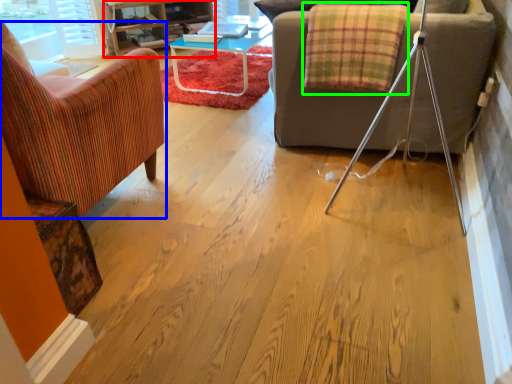
Question: Based on their relative distances, which object is farther from entertainment center (highlighted by a red box)? Choose from chair (highlighted by a blue box) and blanket (highlighted by a green box).

Choices:
 (A) chair
 (B) blanket

Answer: (A)